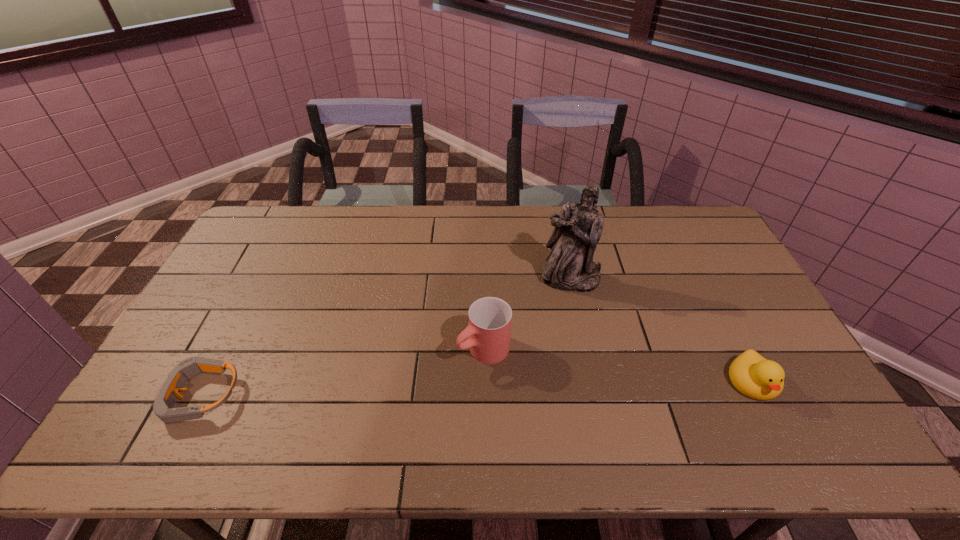
You are a GUI agent. You are given a task and a screenshot of the screen. Output one action in this format:
    pyautogui.click(x=<x>, y=<y>)
    Task: Click on the goggles
    
    Given the screenshot: What is the action you would take?
    pyautogui.click(x=187, y=369)

Find the location of a particular element. Image resolution: width=960 pixels, height=540 pixels. the shortest object is located at coordinates (187, 369).

Identify the location of the third tallest object. This screenshot has width=960, height=540. (754, 376).

At what (x,y) coordinates should I click in order to perform the action: click on the rightmost object. Please return your answer as a coordinate pair (x, y). Looking at the image, I should click on (754, 376).

In order to click on the farthest object in this screenshot , I will do `click(569, 266)`.

This screenshot has height=540, width=960. I want to click on the third object from left to right, so click(569, 266).

Find the location of a particular element. the third shortest object is located at coordinates (488, 332).

Where is `the second object from left to right`? This screenshot has height=540, width=960. the second object from left to right is located at coordinates (488, 332).

Find the location of a particular element. free location located on the front-facing side of the figurine is located at coordinates (561, 328).

Locate an element on the screen. Image resolution: width=960 pixels, height=540 pixels. free space located 0.150m on the front-facing side of the figurine is located at coordinates (561, 328).